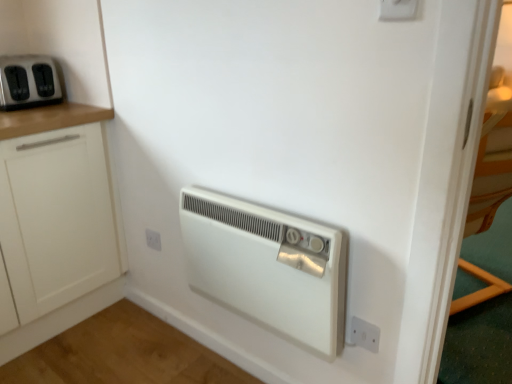
Describe the element at coordinates (365, 334) in the screenshot. I see `white plastic electric outlet at lower right, which is the 1th electric outlet in bottom-to-top order` at that location.

Where is `white plastic heater at center, the 2th home appliance from the back`? The height and width of the screenshot is (384, 512). white plastic heater at center, the 2th home appliance from the back is located at coordinates pyautogui.click(x=267, y=266).

What is the approximate width of white matte cabinet at left?

white matte cabinet at left is 24.55 inches wide.

Image resolution: width=512 pixels, height=384 pixels. What do you see at coordinates (28, 82) in the screenshot?
I see `matte black toaster at upper left, the second home appliance positioned from the bottom` at bounding box center [28, 82].

Locate an element on the screen. Image resolution: width=512 pixels, height=384 pixels. white plastic electric outlet at upper right, the first electric outlet positioned from the front is located at coordinates (398, 10).

Locate an element on the screen. white plastic electric outlet at lower right, which appears as the first electric outlet when viewed from the right is located at coordinates (365, 334).

Considering the positions of points (40, 104) and (374, 332), is point (40, 104) closer to camera compared to point (374, 332)?

No, (40, 104) is further to viewer.

From a real-world perspective, is matte black toaster at upper left, acting as the 2th home appliance starting from the front, beneath white plastic electric outlet at lower right, which appears as the first electric outlet when viewed from the right?

No, from a real-world perspective, matte black toaster at upper left, acting as the 2th home appliance starting from the front, is not beneath white plastic electric outlet at lower right, which appears as the first electric outlet when viewed from the right.

From the picture: Does matte black toaster at upper left, acting as the 1th home appliance starting from the left, have a larger size compared to white plastic electric outlet at lower right, placed as the third electric outlet when sorted from top to bottom?

Yes, matte black toaster at upper left, acting as the 1th home appliance starting from the left, is bigger than white plastic electric outlet at lower right, placed as the third electric outlet when sorted from top to bottom.

Can you confirm if white plastic electric outlet at upper right, the first electric outlet positioned from the front, is positioned to the left of white matte cabinet at left?

No, white plastic electric outlet at upper right, the first electric outlet positioned from the front, is not to the left of white matte cabinet at left.

How many degrees apart are the facing directions of white plastic electric outlet at upper right, the first electric outlet positioned from the front, and white matte cabinet at left?

There is a 91.1-degree angle between the facing directions of white plastic electric outlet at upper right, the first electric outlet positioned from the front, and white matte cabinet at left.

Does white plastic electric outlet at upper right, placed as the 3th electric outlet when sorted from bottom to top, come in front of white matte cabinet at left?

Yes, the depth of white plastic electric outlet at upper right, placed as the 3th electric outlet when sorted from bottom to top, is less than that of white matte cabinet at left.

Is white plastic electric outlet at upper right, which is the 2th electric outlet in right-to-left order, oriented towards white matte cabinet at left?

No.

Is white plastic electric outlet at upper right, positioned as the first electric outlet in top-to-bottom order, behind white plastic electric outlet at lower center, the 3th electric outlet in the front-to-back sequence?

No, white plastic electric outlet at upper right, positioned as the first electric outlet in top-to-bottom order, is closer to the camera.

Is white plastic electric outlet at upper right, which is the 2th electric outlet in right-to-left order, bigger than white plastic electric outlet at lower center, acting as the second electric outlet starting from the top?

Correct, white plastic electric outlet at upper right, which is the 2th electric outlet in right-to-left order, is larger in size than white plastic electric outlet at lower center, acting as the second electric outlet starting from the top.

What's the angular difference between white plastic electric outlet at upper right, the first electric outlet positioned from the front, and white plastic electric outlet at lower center, which appears as the first electric outlet when viewed from the back,'s facing directions?

They differ by 2.4 degrees in their facing directions.

How far apart are white plastic electric outlet at upper right, which is the 2th electric outlet in right-to-left order, and white plastic electric outlet at lower center, the first electric outlet in the left-to-right sequence?

white plastic electric outlet at upper right, which is the 2th electric outlet in right-to-left order, is 4.23 feet away from white plastic electric outlet at lower center, the first electric outlet in the left-to-right sequence.

Is white plastic electric outlet at lower center, the first electric outlet in the left-to-right sequence, completely or partially outside of white plastic heater at center, the 2th home appliance from the back?

white plastic electric outlet at lower center, the first electric outlet in the left-to-right sequence, is positioned outside white plastic heater at center, the 2th home appliance from the back.

I want to click on the 1st home appliance positioned above the white plastic electric outlet at lower center, the 3th electric outlet in the front-to-back sequence (from a real-world perspective), so click(x=267, y=266).

Does white plastic electric outlet at lower center, which ranks as the 2th electric outlet in bottom-to-top order, have a greater width compared to white plastic heater at center, the 2th home appliance from the back?

Incorrect, the width of white plastic electric outlet at lower center, which ranks as the 2th electric outlet in bottom-to-top order, does not surpass that of white plastic heater at center, the 2th home appliance from the back.

Is white plastic electric outlet at lower center, which ranks as the 2th electric outlet in bottom-to-top order, far away from white plastic heater at center, which appears as the first home appliance when viewed from the front?

That's not correct — white plastic electric outlet at lower center, which ranks as the 2th electric outlet in bottom-to-top order, is a little close to white plastic heater at center, which appears as the first home appliance when viewed from the front.

Could you tell me if white plastic electric outlet at lower right, acting as the 2th electric outlet starting from the back, is facing white plastic electric outlet at upper right, which is the 2th electric outlet in right-to-left order?

No, white plastic electric outlet at lower right, acting as the 2th electric outlet starting from the back, is not turned towards white plastic electric outlet at upper right, which is the 2th electric outlet in right-to-left order.

Is white plastic electric outlet at lower right, which is the 1th electric outlet in bottom-to-top order, to the left of white plastic electric outlet at upper right, positioned as the first electric outlet in top-to-bottom order, from the viewer's perspective?

Incorrect, white plastic electric outlet at lower right, which is the 1th electric outlet in bottom-to-top order, is not on the left side of white plastic electric outlet at upper right, positioned as the first electric outlet in top-to-bottom order.

In the scene shown: Is white plastic electric outlet at lower right, which appears as the first electric outlet when viewed from the right, directly adjacent to white plastic electric outlet at upper right, positioned as the first electric outlet in top-to-bottom order?

white plastic electric outlet at lower right, which appears as the first electric outlet when viewed from the right, and white plastic electric outlet at upper right, positioned as the first electric outlet in top-to-bottom order, are clearly separated.

From a real-world perspective, is white plastic electric outlet at lower right, which is the 1th electric outlet in bottom-to-top order, positioned over white plastic electric outlet at upper right, the 2th electric outlet when ordered from left to right, based on gravity?

Incorrect, from a real-world perspective, white plastic electric outlet at lower right, which is the 1th electric outlet in bottom-to-top order, is lower than white plastic electric outlet at upper right, the 2th electric outlet when ordered from left to right.

Considering the points (283, 309) and (15, 161), which point is behind, point (283, 309) or point (15, 161)?

The point (15, 161) is farther from the camera.

Which is correct: white plastic heater at center, the 2th home appliance from the back, is inside white matte cabinet at left, or outside of it?

white plastic heater at center, the 2th home appliance from the back, exists outside the volume of white matte cabinet at left.

From a real-world perspective, between white plastic heater at center, arranged as the 2th home appliance when viewed from the top, and white matte cabinet at left, who is vertically lower?

In real-world perspective, white matte cabinet at left is lower.

Is white plastic heater at center, arranged as the 2th home appliance when viewed from the top, smaller than white matte cabinet at left?

Indeed, white plastic heater at center, arranged as the 2th home appliance when viewed from the top, has a smaller size compared to white matte cabinet at left.

Does white plastic heater at center, which appears as the first home appliance when viewed from the front, turn towards white plastic electric outlet at lower right, which appears as the first electric outlet when viewed from the right?

No, white plastic heater at center, which appears as the first home appliance when viewed from the front, is not oriented towards white plastic electric outlet at lower right, which appears as the first electric outlet when viewed from the right.

Considering the relative sizes of white plastic heater at center, which appears as the first home appliance when viewed from the right, and white plastic electric outlet at lower right, acting as the 2th electric outlet starting from the back, in the image provided, is white plastic heater at center, which appears as the first home appliance when viewed from the right, wider than white plastic electric outlet at lower right, acting as the 2th electric outlet starting from the back,?

Yes, white plastic heater at center, which appears as the first home appliance when viewed from the right, is wider than white plastic electric outlet at lower right, acting as the 2th electric outlet starting from the back.

From the image's perspective, which one is positioned lower, white plastic heater at center, the 2th home appliance from the back, or white plastic electric outlet at lower right, the 2th electric outlet when ordered from front to back?

From the image's view, white plastic electric outlet at lower right, the 2th electric outlet when ordered from front to back, is below.

Where is `the 2nd electric outlet to the right when counting from the white plastic heater at center, which appears as the first home appliance when viewed from the right`? the 2nd electric outlet to the right when counting from the white plastic heater at center, which appears as the first home appliance when viewed from the right is located at coordinates (365, 334).

Locate an element on the screen. This screenshot has width=512, height=384. home appliance that is the 2nd object to the left of the white plastic electric outlet at lower right, acting as the 2th electric outlet starting from the back, starting at the anchor is located at coordinates (28, 82).

Image resolution: width=512 pixels, height=384 pixels. I want to click on electric outlet located above the white matte cabinet at left (from the image's perspective), so click(x=398, y=10).

From the image, which object appears to be farther from matte black toaster at upper left, positioned as the 2th home appliance in right-to-left order, white plastic electric outlet at lower right, placed as the third electric outlet when sorted from top to bottom, or white plastic electric outlet at upper right, positioned as the first electric outlet in top-to-bottom order?

white plastic electric outlet at lower right, placed as the third electric outlet when sorted from top to bottom, lies further to matte black toaster at upper left, positioned as the 2th home appliance in right-to-left order, than the other object.

Considering their positions, is white plastic electric outlet at lower right, the 2th electric outlet when ordered from front to back, positioned further to white plastic electric outlet at upper right, positioned as the first electric outlet in top-to-bottom order, than white matte cabinet at left?

white matte cabinet at left is positioned further to the anchor white plastic electric outlet at upper right, positioned as the first electric outlet in top-to-bottom order.

When comparing their distances from white plastic electric outlet at lower center, the first electric outlet in the left-to-right sequence, does white plastic heater at center, arranged as the 2th home appliance when viewed from the top, or white matte cabinet at left seem further?

white plastic heater at center, arranged as the 2th home appliance when viewed from the top, is positioned further to the anchor white plastic electric outlet at lower center, the first electric outlet in the left-to-right sequence.

When comparing their distances from white plastic electric outlet at lower center, which appears as the first electric outlet when viewed from the back, does white matte cabinet at left or white plastic electric outlet at lower right, which ranks as the third electric outlet in left-to-right order, seem closer?

Based on the image, white matte cabinet at left appears to be nearer to white plastic electric outlet at lower center, which appears as the first electric outlet when viewed from the back.

Estimate the real-world distances between objects in this image. Which object is closer to white plastic electric outlet at upper right, the 2th electric outlet when ordered from left to right, white plastic electric outlet at lower center, which appears as the first electric outlet when viewed from the back, or white plastic heater at center, the 1th home appliance in the bottom-to-top sequence?

white plastic heater at center, the 1th home appliance in the bottom-to-top sequence, is positioned closer to the anchor white plastic electric outlet at upper right, the 2th electric outlet when ordered from left to right.

Based on their spatial positions, is white plastic heater at center, placed as the second home appliance when sorted from left to right, or white matte cabinet at left further from white plastic electric outlet at upper right, the first electric outlet positioned from the front?

Based on the image, white matte cabinet at left appears to be further to white plastic electric outlet at upper right, the first electric outlet positioned from the front.

Considering their positions, is white plastic electric outlet at lower center, the 3th electric outlet in the front-to-back sequence, positioned closer to white plastic electric outlet at lower right, the 2th electric outlet when ordered from front to back, than white plastic heater at center, the 1th home appliance in the bottom-to-top sequence?

white plastic heater at center, the 1th home appliance in the bottom-to-top sequence, lies closer to white plastic electric outlet at lower right, the 2th electric outlet when ordered from front to back, than the other object.

Looking at the image, which one is located closer to white matte cabinet at left, white plastic electric outlet at lower right, which is the 1th electric outlet in bottom-to-top order, or white plastic electric outlet at lower center, the 3th electric outlet in the front-to-back sequence?

The object closer to white matte cabinet at left is white plastic electric outlet at lower center, the 3th electric outlet in the front-to-back sequence.

The width and height of the screenshot is (512, 384). I want to click on electric outlet situated between white matte cabinet at left and white plastic heater at center, the 2th home appliance from the back, from left to right, so click(153, 239).

The height and width of the screenshot is (384, 512). In order to click on electric outlet between matte black toaster at upper left, the second home appliance positioned from the bottom, and white plastic heater at center, the 2th home appliance from the back, in the horizontal direction in this screenshot , I will do `click(153, 239)`.

You are a GUI agent. You are given a task and a screenshot of the screen. Output one action in this format:
    pyautogui.click(x=<x>, y=<y>)
    Task: Click on the cabinetry between matte black toaster at upper left, positioned as the 2th home appliance in right-to-left order, and white plastic electric outlet at lower right, acting as the 2th electric outlet starting from the back
    The height and width of the screenshot is (384, 512).
    Given the screenshot: What is the action you would take?
    pyautogui.click(x=57, y=221)

Locate an element on the screen. The height and width of the screenshot is (384, 512). cabinetry situated between matte black toaster at upper left, arranged as the 1th home appliance when viewed from the back, and white plastic heater at center, which appears as the first home appliance when viewed from the right, from left to right is located at coordinates (x=57, y=221).